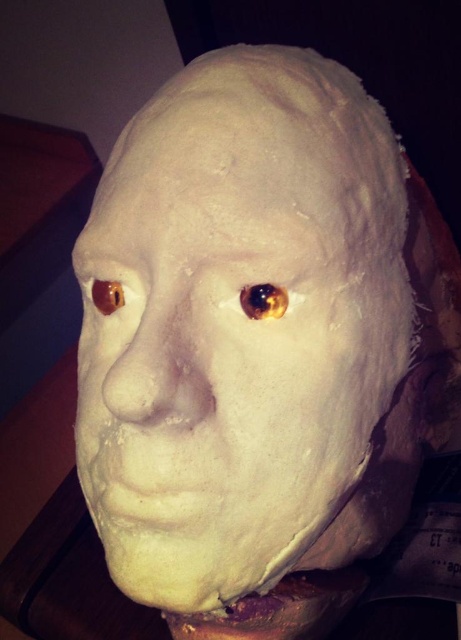
What are the coordinates of the shiny amber eye at center in the image?

The coordinates of the shiny amber eye at center are at point (x=264, y=300).

You are an art student examining a sculpture of a head. You notice a specific point on the sculpture at coordinates point (x=159, y=371). Based on the sculpture description, what part of the sculpture does this point likely represent?

The point (x=159, y=371) corresponds to the matte white nose at center.

Consider the image. You are an art restorer examining the sculpture. You need to apply a protective coating to both the matte white nose at center and the translucent amber eye at upper left. Given that the nose is larger, which object requires more coating material?

The matte white nose at center requires more protective coating material because it has a larger size compared to the translucent amber eye at upper left.